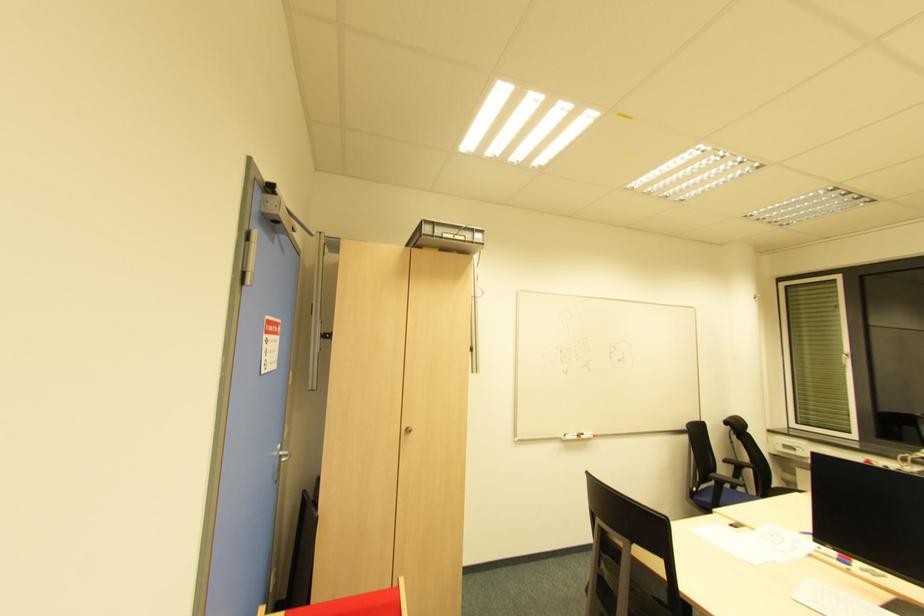
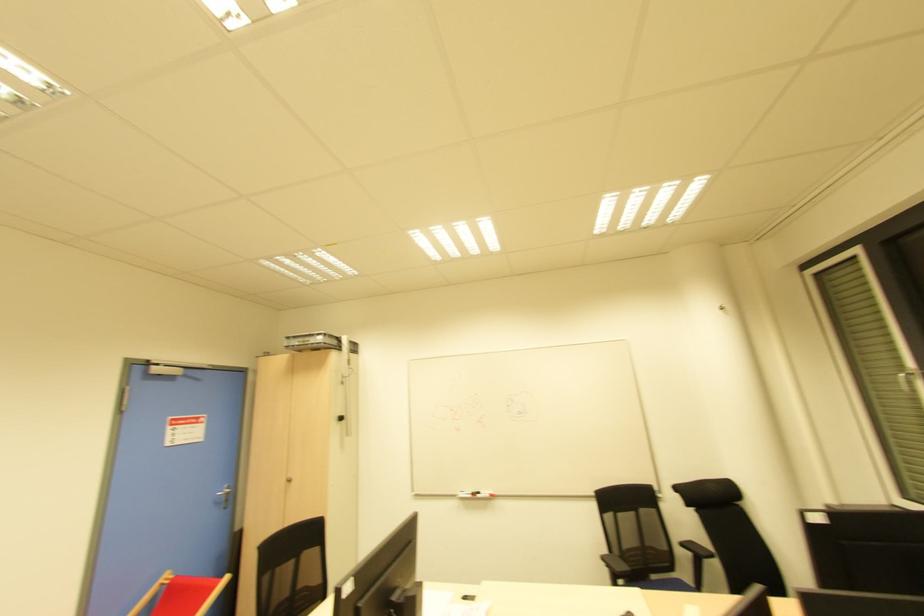
Locate, in the second image, the point that corresponds to point (594, 438) in the first image.

(492, 496)